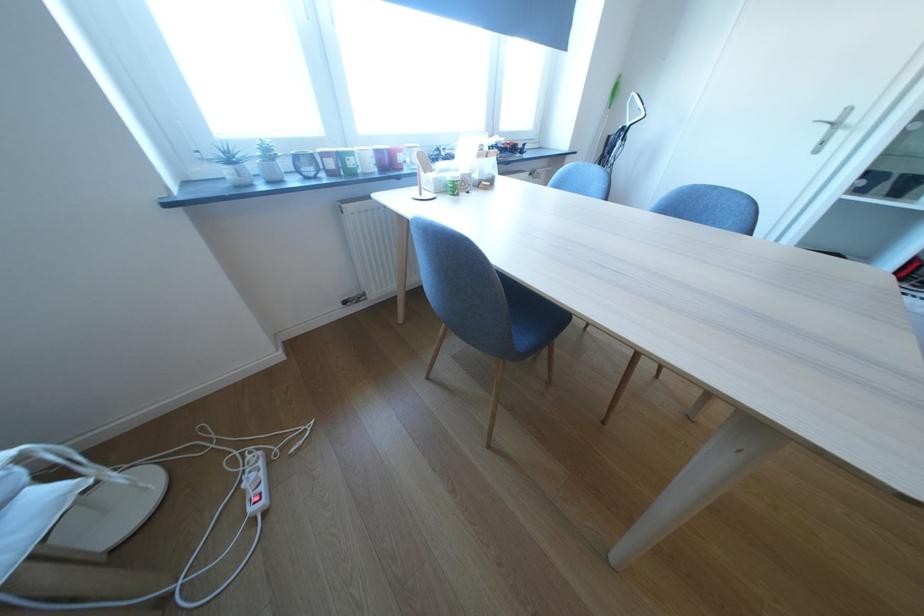
This screenshot has height=616, width=924. What do you see at coordinates (849, 124) in the screenshot?
I see `a silver door handle` at bounding box center [849, 124].